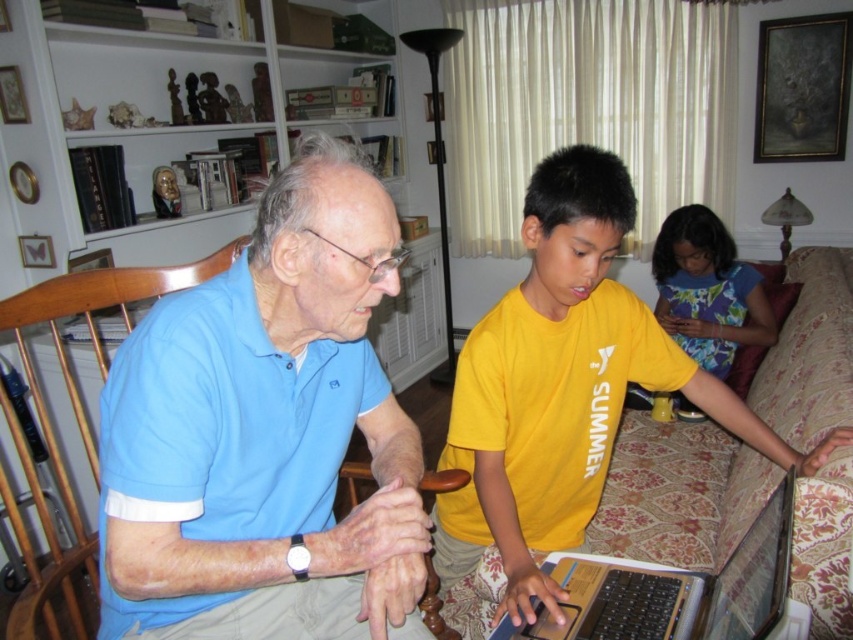
Question: Which point is farther to the camera?

Choices:
 (A) light blue cotton shirt at left
 (B) yellow cotton shirt at center

Answer: (B)

Question: Does yellow cotton shirt at center have a smaller size compared to white plastic laptop at lower center?

Choices:
 (A) yes
 (B) no

Answer: (B)

Question: Which object is positioned closest to the yellow cotton shirt at center?

Choices:
 (A) white plastic laptop at lower center
 (B) light blue cotton shirt at left
 (C) floral fabric dress at center

Answer: (A)

Question: Is white plastic laptop at lower center thinner than floral fabric dress at center?

Choices:
 (A) yes
 (B) no

Answer: (A)

Question: Among these points, which one is nearest to the camera?

Choices:
 (A) (735, 618)
 (B) (212, 538)

Answer: (A)

Question: In this image, where is yellow cotton shirt at center located relative to floral fabric dress at center?

Choices:
 (A) right
 (B) left

Answer: (B)